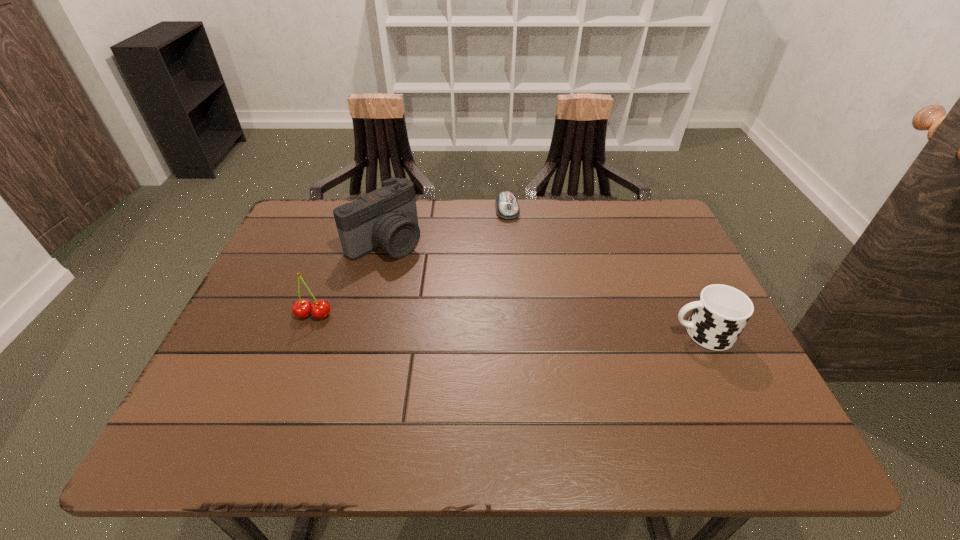
The image size is (960, 540). Identify the location of cherry. (320, 309).

You are a GUI agent. You are given a task and a screenshot of the screen. Output one action in this format:
    pyautogui.click(x=<x>, y=<y>)
    Task: Click on the rightmost object
    This screenshot has width=960, height=540.
    Given the screenshot: What is the action you would take?
    pyautogui.click(x=721, y=312)

Where is `camera`? camera is located at coordinates (387, 217).

I want to click on computer mouse, so click(x=507, y=207).

At what (x,y) coordinates should I click in order to perform the action: click on the shortest object. Please return your answer as a coordinate pair (x, y). The width and height of the screenshot is (960, 540). Looking at the image, I should click on (507, 207).

Locate an element on the screen. The width and height of the screenshot is (960, 540). vacant space located 0.080m with the stems of the cherry pointing upwards is located at coordinates coord(301,349).

You are a GUI agent. You are given a task and a screenshot of the screen. Output one action in this format:
    pyautogui.click(x=<x>, y=<y>)
    Task: Click on the free space located on the side of the rightmost object with the handle
    
    Given the screenshot: What is the action you would take?
    pyautogui.click(x=545, y=333)

At what (x,y) coordinates should I click in order to perform the action: click on free space located 0.120m on the side of the rightmost object with the handle. Please return your answer as a coordinate pair (x, y). The image size is (960, 540). Looking at the image, I should click on (619, 333).

Image resolution: width=960 pixels, height=540 pixels. Find the location of `vacant space located on the side of the rightmost object with the handle`. vacant space located on the side of the rightmost object with the handle is located at coordinates (602, 333).

What are the coordinates of `vacant space located 0.100m at the lens of the camera` in the screenshot? It's located at (432, 276).